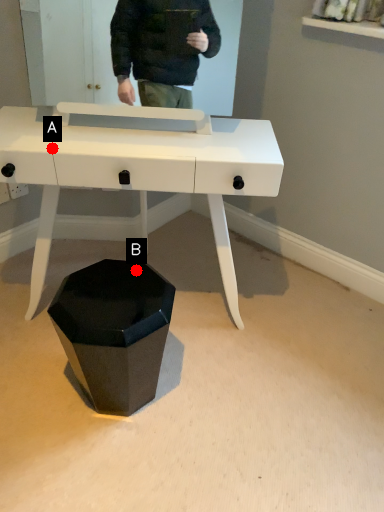
Question: Two points are circled on the image, labeled by A and B beside each circle. Which point is further to the camera?

Choices:
 (A) A is further
 (B) B is further

Answer: (B)